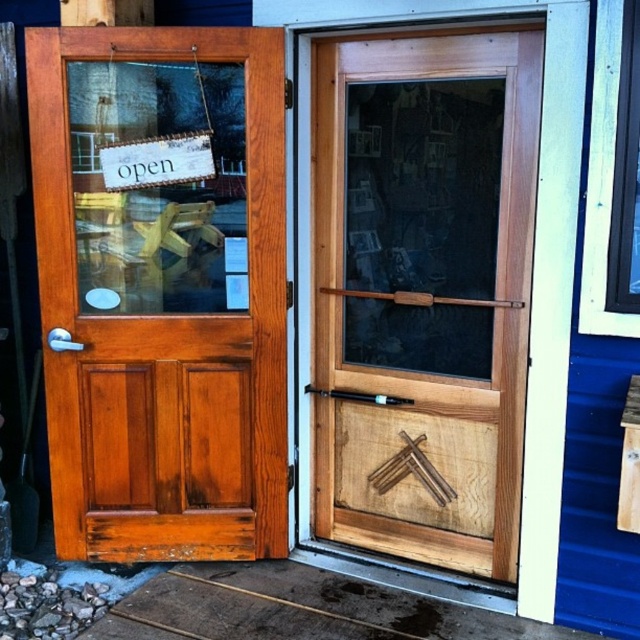
Question: Which of the following is the closest to the observer?

Choices:
 (A) shiny brown wood door at left
 (B) white paper sign at upper left

Answer: (A)

Question: Which object is positioned farthest from the clear glass window at upper right?

Choices:
 (A) shiny brown wood door at left
 (B) white paper sign at upper left

Answer: (B)

Question: Is clear glass window at upper right thinner than white paper sign at upper left?

Choices:
 (A) yes
 (B) no

Answer: (A)

Question: Which object is closer to the camera taking this photo?

Choices:
 (A) white paper sign at upper left
 (B) shiny brown wood door at left
 (C) clear glass window at upper right

Answer: (C)

Question: Does shiny brown wood door at left have a lesser width compared to white paper sign at upper left?

Choices:
 (A) no
 (B) yes

Answer: (A)

Question: Is shiny brown wood door at left above white paper sign at upper left?

Choices:
 (A) yes
 (B) no

Answer: (B)